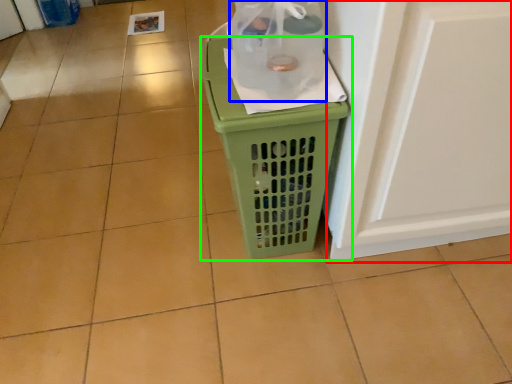
Question: Which object is positioned farthest from screen door (highlighted by a red box)? Select from bottle (highlighted by a blue box) and waste container (highlighted by a green box).

Choices:
 (A) bottle
 (B) waste container

Answer: (A)